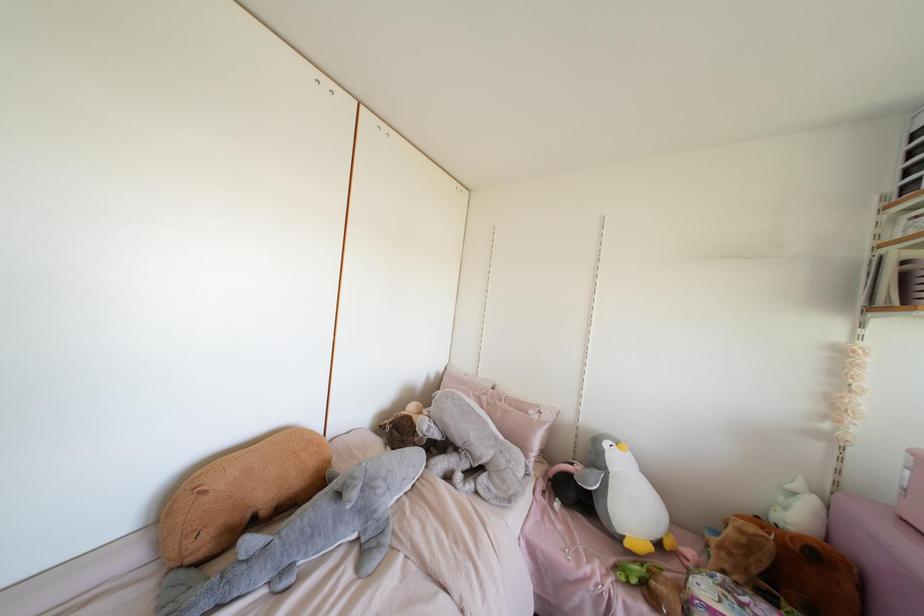
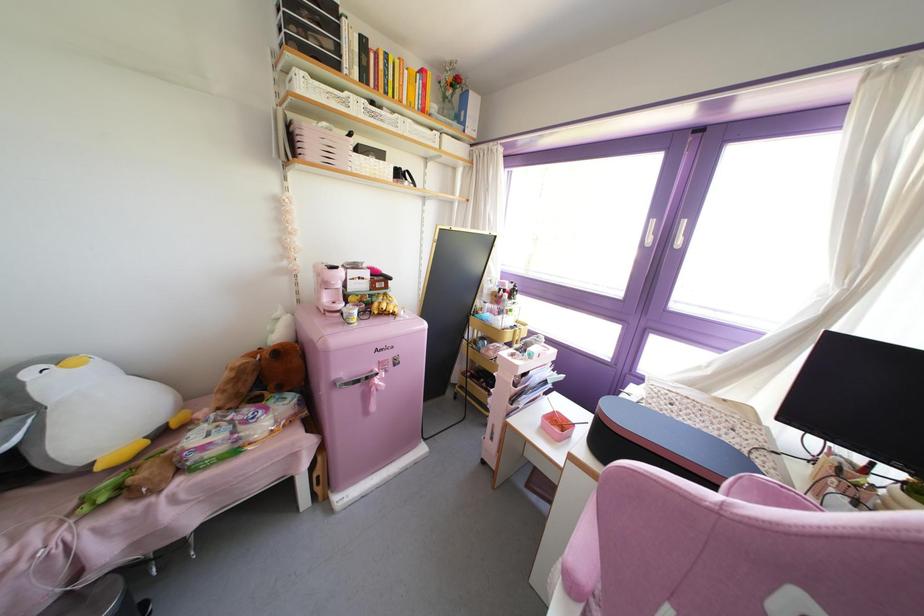
The first image is from the beginning of the video and the second image is from the end. How did the camera likely rotate when shooting the video?

The camera's rotation is toward right-down.